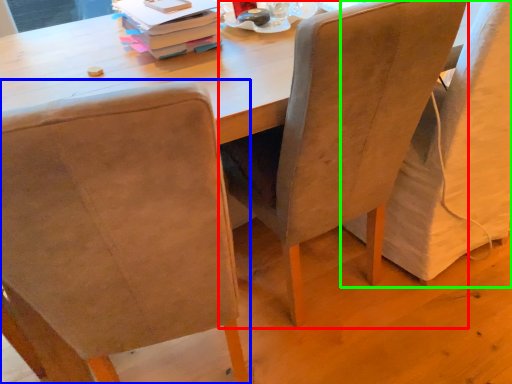
Question: Which object is positioned closest to chair (highlighted by a red box)? Select from chair (highlighted by a blue box) and chair (highlighted by a green box).

Choices:
 (A) chair
 (B) chair

Answer: (B)